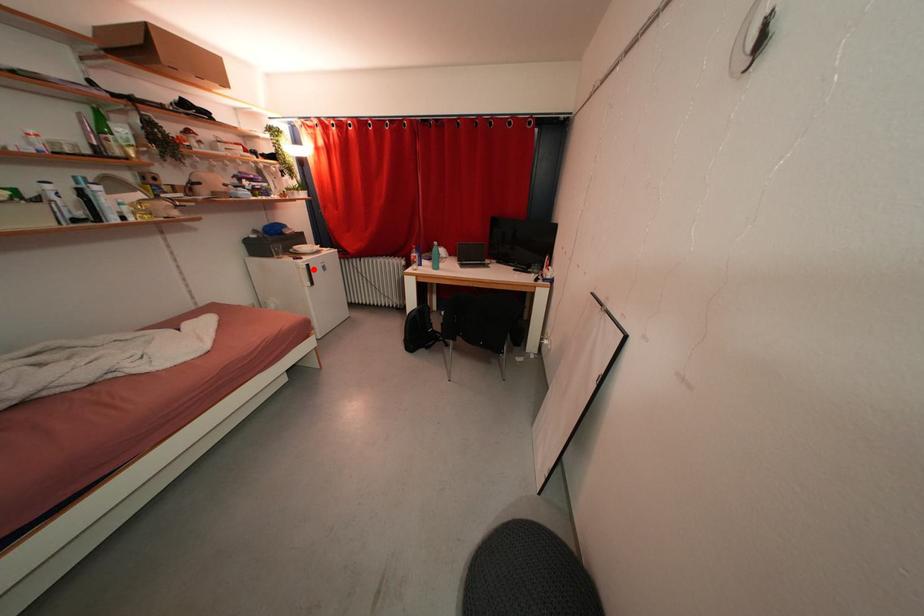
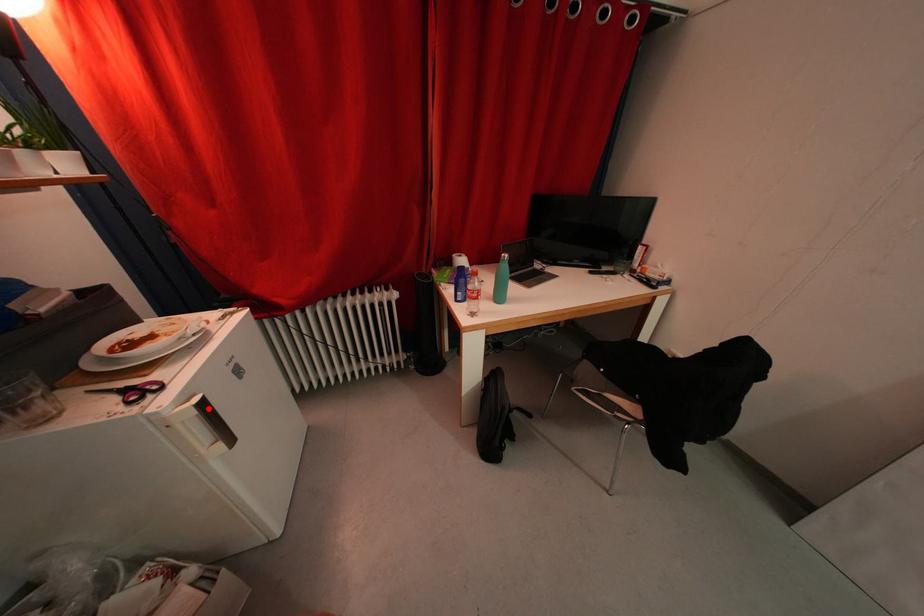
I am providing you with two images of the same scene from different viewpoints. A red point is marked on the first image and another point is marked on the second image. Is the red point in image1 aligned with the point shown in image2?

Yes